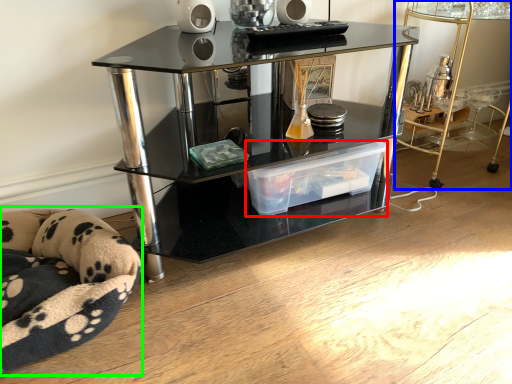
Question: Based on their relative distances, which object is nearer to storage box (highlighted by a red box)? Choose from table (highlighted by a blue box) and swivel chair (highlighted by a green box).

Choices:
 (A) table
 (B) swivel chair

Answer: (B)